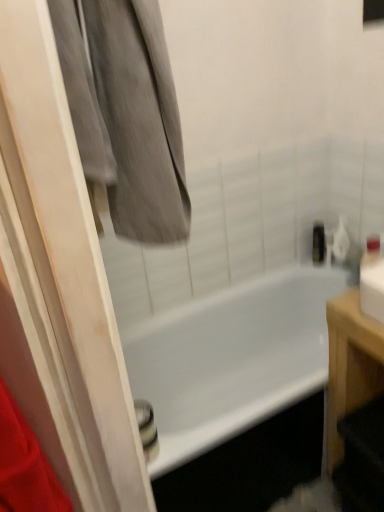
Question: Can you confirm if white glossy bathtub at center is shorter than metallic silver toiletry at upper right?

Choices:
 (A) no
 (B) yes

Answer: (A)

Question: From the image's perspective, is white glossy bathtub at center beneath metallic silver toiletry at upper right?

Choices:
 (A) yes
 (B) no

Answer: (A)

Question: Considering the relative sizes of white glossy bathtub at center and metallic silver toiletry at upper right in the image provided, is white glossy bathtub at center taller than metallic silver toiletry at upper right?

Choices:
 (A) yes
 (B) no

Answer: (A)

Question: Is white glossy bathtub at center far from metallic silver toiletry at upper right?

Choices:
 (A) yes
 (B) no

Answer: (B)

Question: Is white glossy bathtub at center turned away from metallic silver toiletry at upper right?

Choices:
 (A) yes
 (B) no

Answer: (B)

Question: Can metallic silver toiletry at upper right be found inside white glossy bathtub at center?

Choices:
 (A) yes
 (B) no

Answer: (B)

Question: Is gray fabric at upper left not near light brown wooden table at right?

Choices:
 (A) no
 (B) yes

Answer: (A)

Question: Can light brown wooden table at right be found inside gray fabric at upper left?

Choices:
 (A) yes
 (B) no

Answer: (B)

Question: Is the surface of gray fabric at upper left in direct contact with light brown wooden table at right?

Choices:
 (A) no
 (B) yes

Answer: (A)

Question: Can you confirm if gray fabric at upper left is positioned to the right of light brown wooden table at right?

Choices:
 (A) yes
 (B) no

Answer: (B)

Question: Is gray fabric at upper left at the left side of light brown wooden table at right?

Choices:
 (A) no
 (B) yes

Answer: (B)

Question: From a real-world perspective, is gray fabric at upper left below light brown wooden table at right?

Choices:
 (A) no
 (B) yes

Answer: (A)

Question: Are metallic silver toiletry at upper right and white glossy bathtub at center making contact?

Choices:
 (A) yes
 (B) no

Answer: (B)